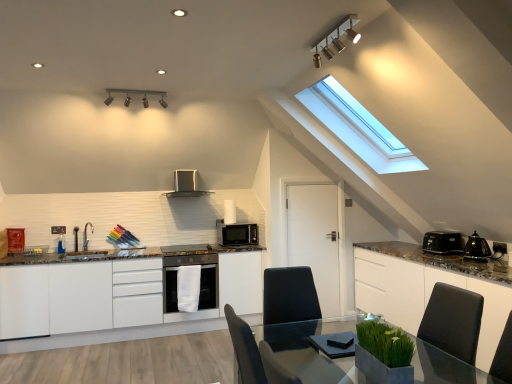
Where is `free location above matte silver light fixture at upper center, which is counted as the 2th light fixture, starting from the right (from a real-world perspective)`? free location above matte silver light fixture at upper center, which is counted as the 2th light fixture, starting from the right (from a real-world perspective) is located at coordinates (128, 87).